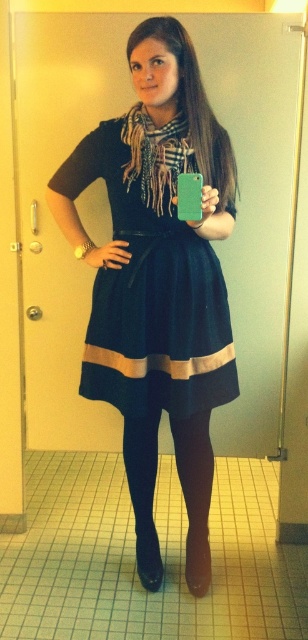
You are a fashion designer observing a model wearing a navy velvet dress at center and holding a plaid wool scarf at center. Which item is taller?

The navy velvet dress at center is much taller than the plaid wool scarf at center.

You are a fashion designer who needs to ensure that the navy velvet dress at center and the plaid wool scarf at center are displayed properly in a catalog. What is the minimum distance required between the two items to avoid overlapping in the catalog photo?

The navy velvet dress at center is 7.23 inches from plaid wool scarf at center, so the minimum distance required between them to avoid overlapping in the catalog photo should be at least 7.23 inches.